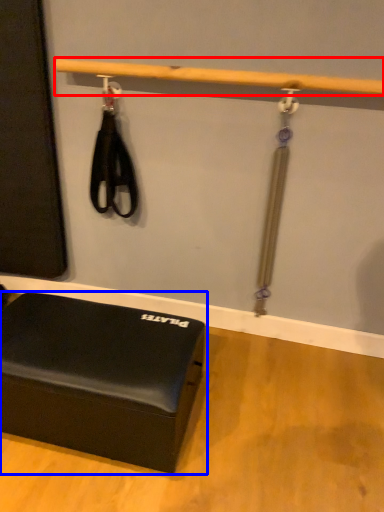
Question: Among these objects, which one is nearest to the camera, beam (highlighted by a red box) or furniture (highlighted by a blue box)?

Choices:
 (A) beam
 (B) furniture

Answer: (B)